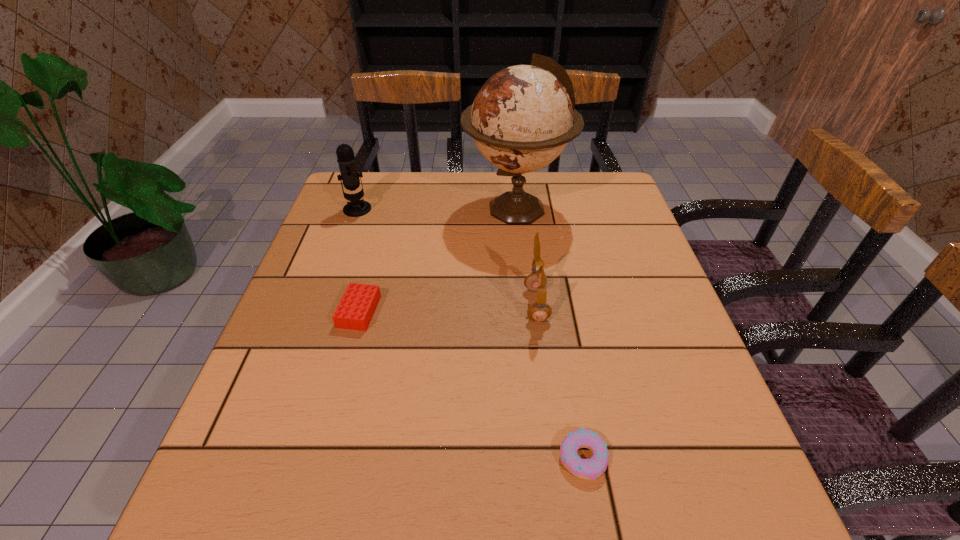
The width and height of the screenshot is (960, 540). Identify the location of microphone at the left edge. (346, 160).

Locate an element on the screen. Lego present at the left edge is located at coordinates (357, 306).

Where is `object that is at the far left corner`? object that is at the far left corner is located at coordinates (346, 160).

Identify the location of free space at the far edge of the desktop. Image resolution: width=960 pixels, height=540 pixels. (544, 200).

In the image, there is a desktop. Identify the location of vacant area at the near edge. The image size is (960, 540). (568, 517).

The height and width of the screenshot is (540, 960). Identify the location of vacant area at the left edge. pyautogui.click(x=301, y=328).

In the image, there is a desktop. Where is `vacant space at the right edge`? Image resolution: width=960 pixels, height=540 pixels. vacant space at the right edge is located at coordinates (666, 317).

Find the location of `vacant space at the far right corner`. vacant space at the far right corner is located at coordinates pyautogui.click(x=608, y=197).

This screenshot has width=960, height=540. Identify the location of free space between the fourth shortest object and the tallest object. tap(437, 209).

In order to click on unoccupied area between the microphone and the doughnut in this screenshot , I will do `click(470, 334)`.